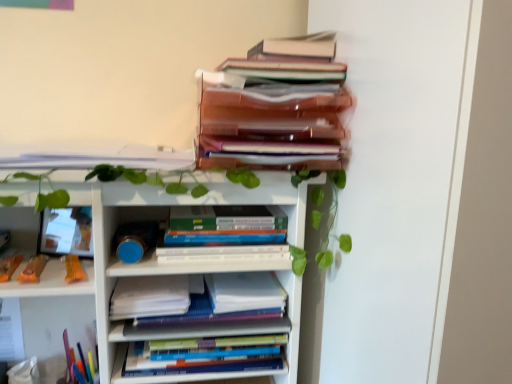
Identify the location of blank space situated above white paper at center, which appears as the 1th paperback book when viewed from the right (from a real-world perspective). The height and width of the screenshot is (384, 512). pyautogui.click(x=246, y=280).